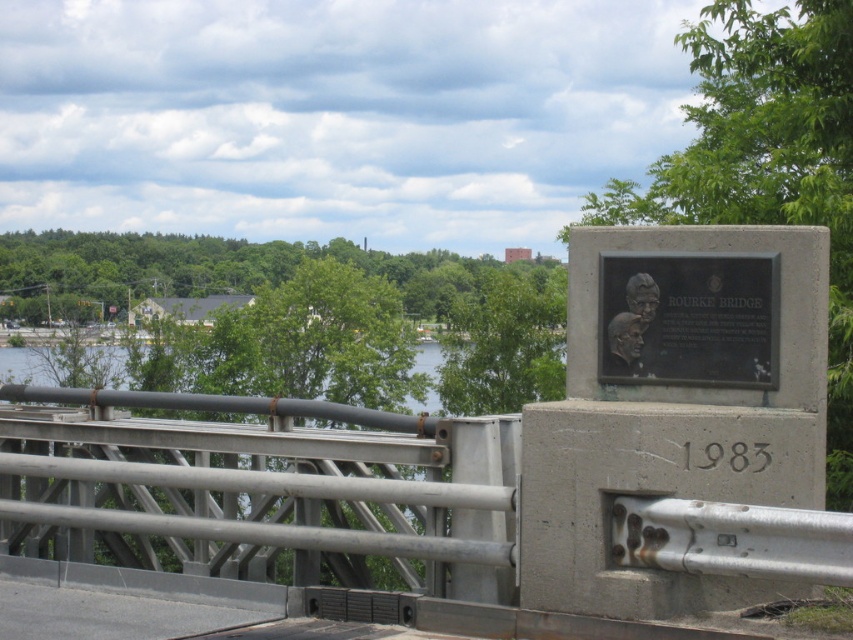
Question: Does gray metallic bridge at center appear on the right side of gray concrete plaque at right?

Choices:
 (A) no
 (B) yes

Answer: (A)

Question: Based on their relative distances, which object is nearer to the black polished metal plaque at center?

Choices:
 (A) gray metallic bridge at center
 (B) gray concrete plaque at right

Answer: (B)

Question: Which point appears closest to the camera in this image?

Choices:
 (A) (747, 369)
 (B) (706, 522)
 (C) (769, 298)

Answer: (B)

Question: Is gray metallic bridge at center bigger than black polished metal plaque at center?

Choices:
 (A) yes
 (B) no

Answer: (A)

Question: Which point is farther to the camera?

Choices:
 (A) black polished metal plaque at center
 (B) gray concrete plaque at right
 (C) gray metallic bridge at center

Answer: (A)

Question: Is gray concrete plaque at right positioned at the back of black polished metal plaque at center?

Choices:
 (A) yes
 (B) no

Answer: (B)